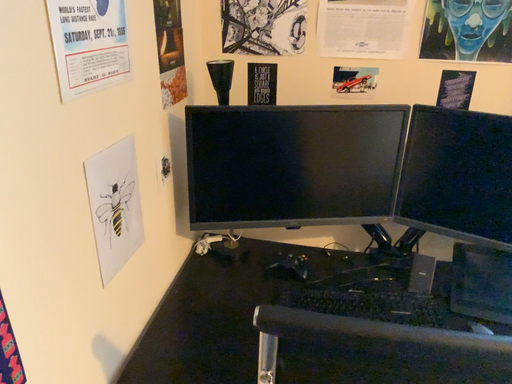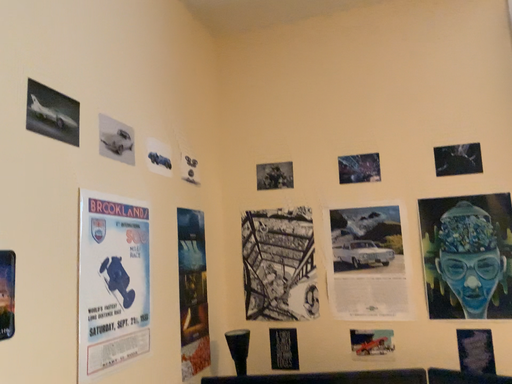
Question: How did the camera likely rotate when shooting the video?

Choices:
 (A) rotated left
 (B) rotated right

Answer: (A)